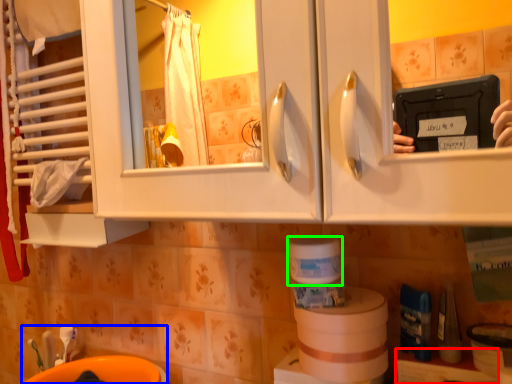
Question: Based on their relative distances, which object is farther from shelf (highlighted by a red box)? Choose from sink (highlighted by a blue box) and toilet paper (highlighted by a green box).

Choices:
 (A) sink
 (B) toilet paper

Answer: (A)